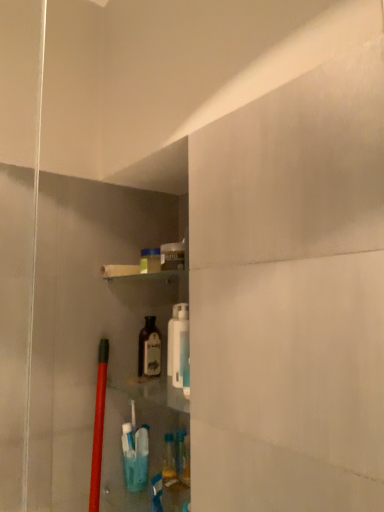
Question: Considering the positions of point (147, 315) and point (175, 327), is point (147, 315) closer or farther from the camera than point (175, 327)?

Choices:
 (A) closer
 (B) farther

Answer: (B)

Question: Is translucent glass bottle at center wider or thinner than white plastic bottle at center?

Choices:
 (A) wide
 (B) thin

Answer: (A)

Question: Would you say translucent glass bottle at center is to the left or to the right of white plastic bottle at center in the picture?

Choices:
 (A) right
 (B) left

Answer: (B)

Question: Considering the positions of white plastic bottle at center and translucent glass bottle at center in the image, is white plastic bottle at center bigger or smaller than translucent glass bottle at center?

Choices:
 (A) small
 (B) big

Answer: (B)

Question: From their relative heights in the image, would you say white plastic bottle at center is taller or shorter than translucent glass bottle at center?

Choices:
 (A) tall
 (B) short

Answer: (A)

Question: From a real-world perspective, is white plastic bottle at center above or below translucent glass bottle at center?

Choices:
 (A) above
 (B) below

Answer: (A)

Question: Considering their positions, is white plastic bottle at center located in front of or behind translucent glass bottle at center?

Choices:
 (A) behind
 (B) front

Answer: (B)